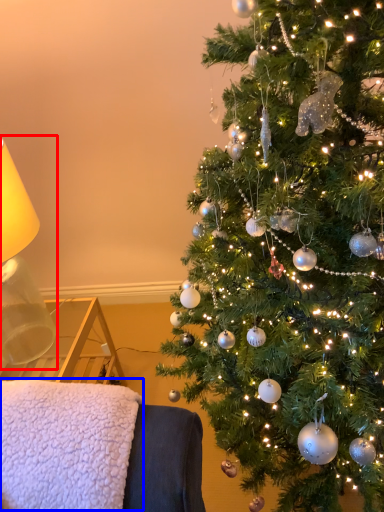
Question: Which object is further to the camera taking this photo, table lamp (highlighted by a red box) or blanket (highlighted by a blue box)?

Choices:
 (A) table lamp
 (B) blanket

Answer: (A)